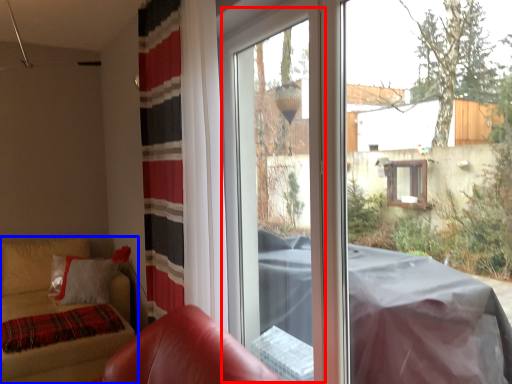
Question: Which point is closer to the camera, screen door (highlighted by a red box) or furniture (highlighted by a blue box)?

Choices:
 (A) screen door
 (B) furniture

Answer: (A)